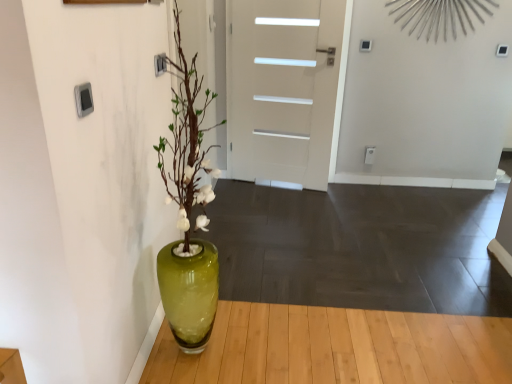
Question: Should I look upward or downward to see white matte door at center?

Choices:
 (A) up
 (B) down

Answer: (A)